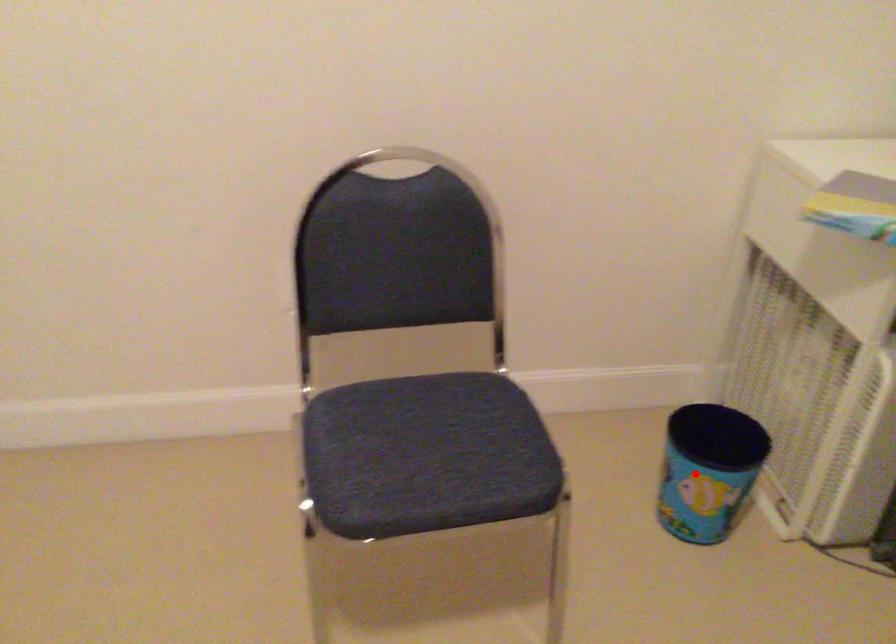
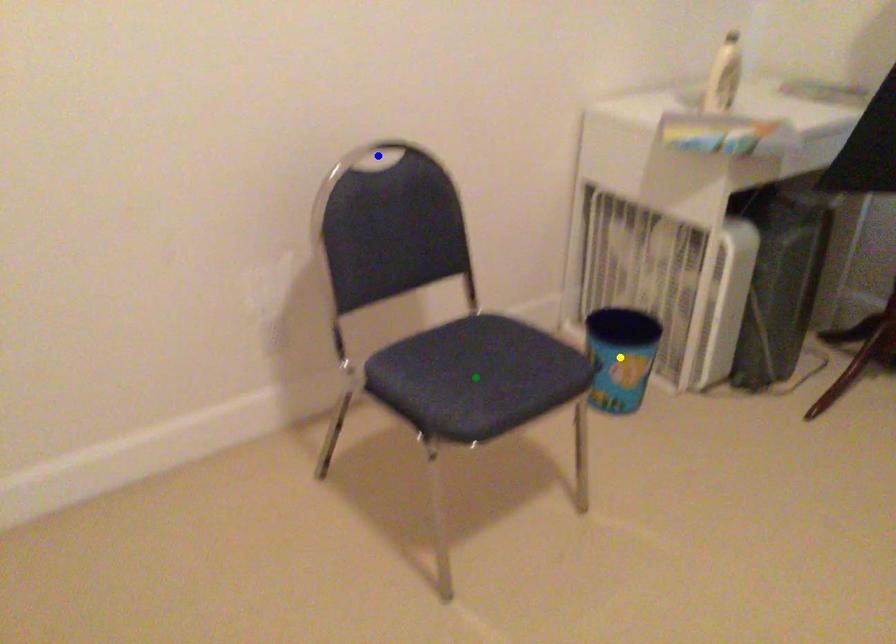
Question: I am providing you with two images of the same scene from different viewpoints. A red point is marked on the first image. You are given multiple points on the second image. In image 2, which mark is for the same physical point as the one in image 1?

Choices:
 (A) blue point
 (B) yellow point
 (C) green point

Answer: (B)